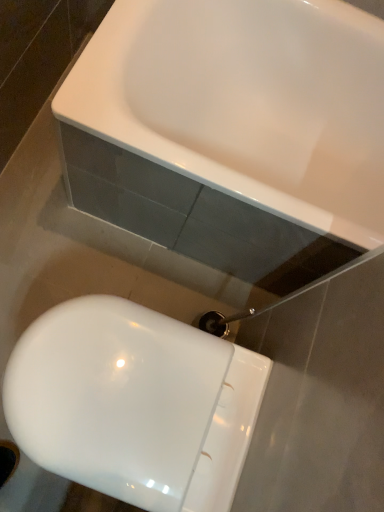
At what (x,y) coordinates should I click in order to perform the action: click on white glossy bathtub at upper center. Please return your answer as a coordinate pair (x, y). This screenshot has width=384, height=512. Looking at the image, I should click on (246, 102).

What do you see at coordinates (246, 102) in the screenshot? This screenshot has height=512, width=384. I see `white glossy bathtub at upper center` at bounding box center [246, 102].

Looking at this image, measure the distance between white glossy bathtub at upper center and camera.

white glossy bathtub at upper center and camera are 35.86 inches apart from each other.

In order to face white glossy toilet at lower left, should I rotate leftwards or rightwards?

You should look left and rotate roughly 9.053 degrees.

At what (x,y) coordinates should I click in order to perform the action: click on white glossy toilet at lower left. Please return your answer as a coordinate pair (x, y). The image size is (384, 512). Looking at the image, I should click on (134, 404).

Describe the element at coordinates (134, 404) in the screenshot. This screenshot has height=512, width=384. I see `white glossy toilet at lower left` at that location.

Where is `white glossy bathtub at upper center`? white glossy bathtub at upper center is located at coordinates (246, 102).

Considering the relative positions of white glossy toilet at lower left and white glossy bathtub at upper center in the image provided, is white glossy toilet at lower left to the right of white glossy bathtub at upper center from the viewer's perspective?

Incorrect, white glossy toilet at lower left is not on the right side of white glossy bathtub at upper center.

Is white glossy toilet at lower left in front of or behind white glossy bathtub at upper center in the image?

white glossy toilet at lower left is positioned closer to the viewer than white glossy bathtub at upper center.

Between point (73, 346) and point (202, 41), which one is positioned behind?

The point (202, 41) is more distant.

From the image's perspective, which one is positioned higher, white glossy toilet at lower left or white glossy bathtub at upper center?

white glossy bathtub at upper center.

From a real-world perspective, who is located higher, white glossy toilet at lower left or white glossy bathtub at upper center?

white glossy bathtub at upper center, from a real-world perspective.

Does white glossy toilet at lower left have a lesser width compared to white glossy bathtub at upper center?

Correct, the width of white glossy toilet at lower left is less than that of white glossy bathtub at upper center.

Which of these two, white glossy toilet at lower left or white glossy bathtub at upper center, stands shorter?

white glossy toilet at lower left.

Can you confirm if white glossy toilet at lower left is bigger than white glossy bathtub at upper center?

Incorrect, white glossy toilet at lower left is not larger than white glossy bathtub at upper center.

In the scene shown: Is white glossy toilet at lower left not within white glossy bathtub at upper center?

Absolutely, white glossy toilet at lower left is external to white glossy bathtub at upper center.

Would you consider white glossy toilet at lower left to be distant from white glossy bathtub at upper center?

That's not correct — white glossy toilet at lower left is a little close to white glossy bathtub at upper center.

Is white glossy toilet at lower left oriented towards white glossy bathtub at upper center?

No.

You are a GUI agent. You are given a task and a screenshot of the screen. Output one action in this format:
    pyautogui.click(x=<x>, y=<y>)
    Task: Click on the toilet in front of the white glossy bathtub at upper center
    The image size is (384, 512).
    Given the screenshot: What is the action you would take?
    pyautogui.click(x=134, y=404)

Can you confirm if white glossy bathtub at upper center is positioned to the right of white glossy toilet at lower left?

Indeed, white glossy bathtub at upper center is positioned on the right side of white glossy toilet at lower left.

Considering the relative positions of white glossy bathtub at upper center and white glossy toilet at lower left in the image provided, is white glossy bathtub at upper center behind white glossy toilet at lower left?

Yes, white glossy bathtub at upper center is further from the camera.

Between point (113, 99) and point (205, 346), which one is positioned in front?

Point (205, 346)

From the image's perspective, is white glossy bathtub at upper center above white glossy toilet at lower left?

Yes, from the image's perspective, white glossy bathtub at upper center is on top of white glossy toilet at lower left.

From a real-world perspective, is white glossy bathtub at upper center located beneath white glossy toilet at lower left?

Incorrect, from a real-world perspective, white glossy bathtub at upper center is higher than white glossy toilet at lower left.

Between white glossy bathtub at upper center and white glossy toilet at lower left, which one has smaller width?

Thinner between the two is white glossy toilet at lower left.

Who is taller, white glossy bathtub at upper center or white glossy toilet at lower left?

white glossy bathtub at upper center.

Can you confirm if white glossy bathtub at upper center is smaller than white glossy toilet at lower left?

No.

Would you say white glossy bathtub at upper center is inside or outside white glossy toilet at lower left?

white glossy bathtub at upper center is spatially situated outside white glossy toilet at lower left.

Are white glossy bathtub at upper center and white glossy toilet at lower left far apart?

white glossy bathtub at upper center is near white glossy toilet at lower left, not far away.

Does white glossy bathtub at upper center turn towards white glossy toilet at lower left?

No, white glossy bathtub at upper center is not aimed at white glossy toilet at lower left.

How much distance is there between white glossy bathtub at upper center and white glossy toilet at lower left?

23.13 inches.

In the image, there is a white glossy bathtub at upper center. At what (x,y) coordinates should I click in order to perform the action: click on toilet below it (from the image's perspective). Please return your answer as a coordinate pair (x, y). Image resolution: width=384 pixels, height=512 pixels. Looking at the image, I should click on (134, 404).

Where is `sink behind the white glossy toilet at lower left`? sink behind the white glossy toilet at lower left is located at coordinates (246, 102).

Find the location of `sink on the right of white glossy toilet at lower left`. sink on the right of white glossy toilet at lower left is located at coordinates (246, 102).